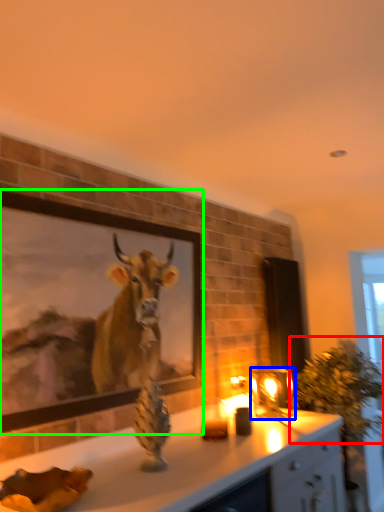
Question: Which is nearer to the plant (highlighted by a red box)? candle holder (highlighted by a blue box) or picture frame (highlighted by a green box).

Choices:
 (A) candle holder
 (B) picture frame

Answer: (A)